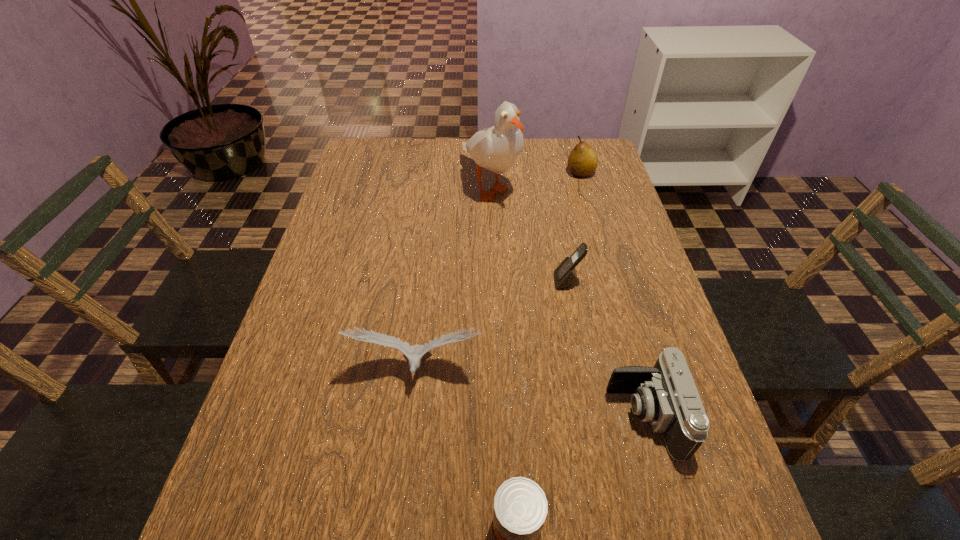
Where is `the tallest object`? The width and height of the screenshot is (960, 540). the tallest object is located at coordinates (496, 148).

Image resolution: width=960 pixels, height=540 pixels. What are the coordinates of `the farther gull` in the screenshot? It's located at (496, 148).

Identify the location of the nearer gull. pos(414,353).

Where is `pear`? This screenshot has width=960, height=540. pear is located at coordinates (582, 162).

The image size is (960, 540). Identify the location of cellular telephone. (565, 275).

Locate an element on the screen. the third object from right to left is located at coordinates (565, 275).

The image size is (960, 540). What are the coordinates of `camera` in the screenshot? It's located at (665, 395).

I want to click on blank space located 0.070m at the beak of the taller gull, so click(492, 235).

Locate an element on the screen. The height and width of the screenshot is (540, 960). vacant space located at the tip of the beak of the nearer gull is located at coordinates (413, 418).

At what (x,y) coordinates should I click in order to perform the action: click on free spot located on the front of the pear. Please return your answer as a coordinate pair (x, y). Looking at the image, I should click on [590, 207].